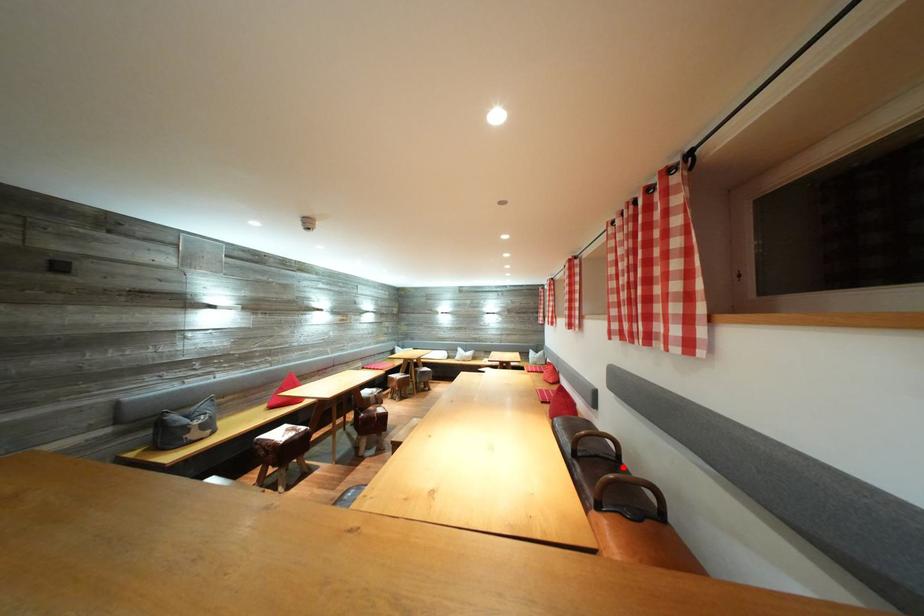
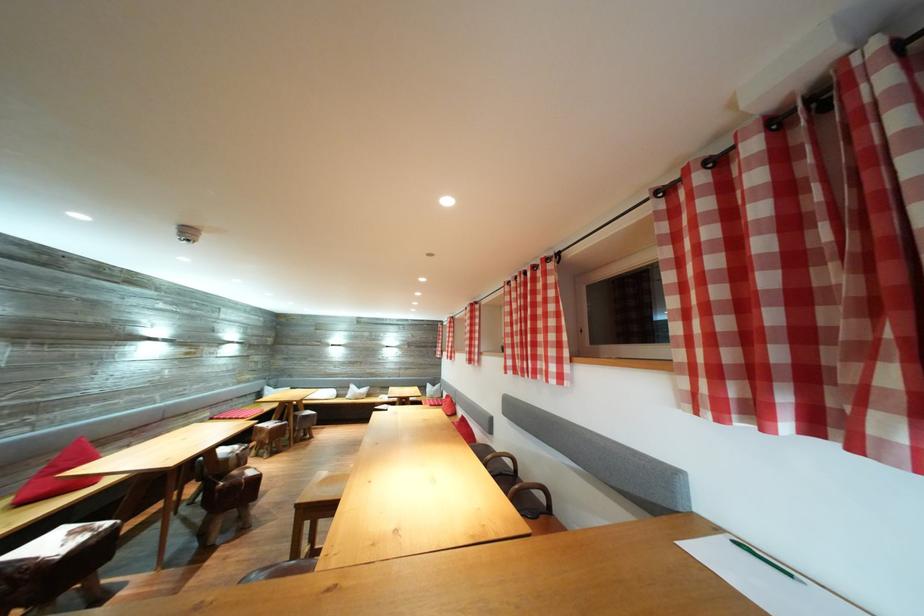
Question: I am providing you with two images of the same scene from different viewpoints. Image1 has a red point marked. In image2, the corresponding 3D location appears at what relative position? Reply with the corresponding letter.

Choices:
 (A) Closer
 (B) Farther

Answer: (B)